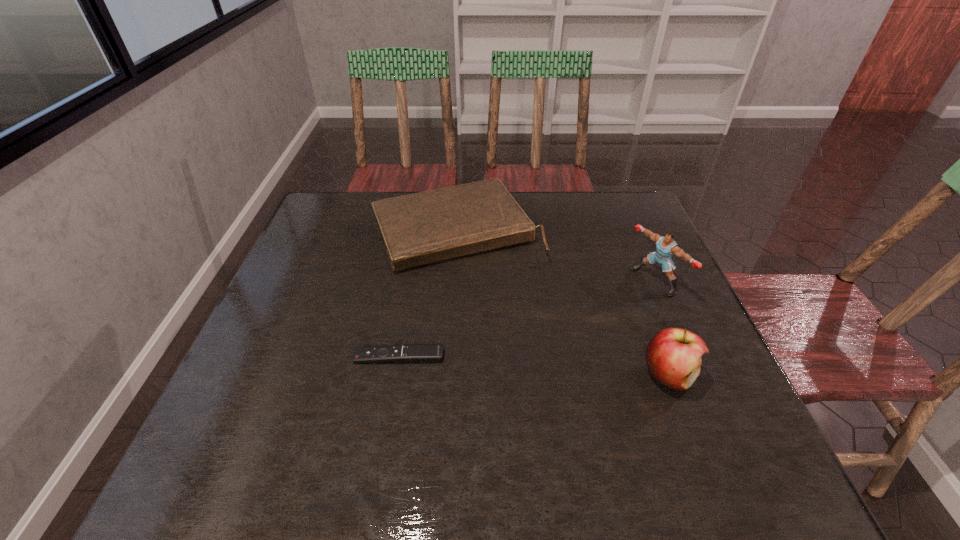
What are the coordinates of `vacant space at the far right corner of the desktop` in the screenshot? It's located at (597, 227).

The width and height of the screenshot is (960, 540). Find the location of `vacant space in between the remote control and the paperback book`. vacant space in between the remote control and the paperback book is located at coordinates click(x=428, y=293).

This screenshot has height=540, width=960. Identify the location of free spot between the apple and the shortest object. (534, 366).

Locate an element on the screen. free point between the third shortest object and the second shortest object is located at coordinates (563, 302).

Find the location of a particular element. This screenshot has width=960, height=540. free space between the tallest object and the apple is located at coordinates (661, 328).

Locate an element on the screen. This screenshot has width=960, height=540. free space between the second tallest object and the third tallest object is located at coordinates (563, 302).

The width and height of the screenshot is (960, 540). Find the location of `unoccupied area between the tallest object and the apple`. unoccupied area between the tallest object and the apple is located at coordinates (661, 328).

Locate an element on the screen. The width and height of the screenshot is (960, 540). free point between the third tallest object and the puncher is located at coordinates (556, 255).

Find the location of a particular element. This screenshot has height=540, width=960. vacant region between the remote control and the puncher is located at coordinates (527, 319).

Locate an element on the screen. free point between the apple and the puncher is located at coordinates (661, 328).